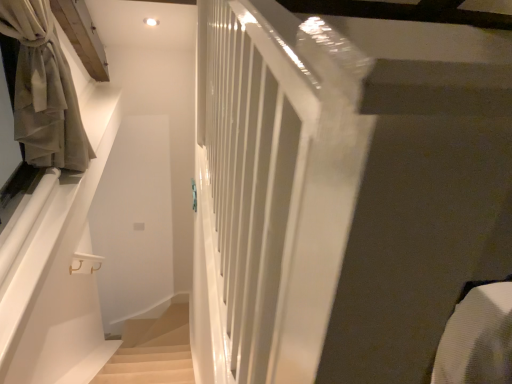
Question: Is beige fabric curtain at left in front of or behind beige carpeted stairs at lower left in the image?

Choices:
 (A) behind
 (B) front

Answer: (B)

Question: Considering the positions of point (42, 14) and point (110, 377), is point (42, 14) closer or farther from the camera than point (110, 377)?

Choices:
 (A) closer
 (B) farther

Answer: (A)

Question: Would you say beige fabric curtain at left is inside or outside beige carpeted stairs at lower left?

Choices:
 (A) inside
 (B) outside

Answer: (B)

Question: From the image's perspective, is beige carpeted stairs at lower left located above or below beige fabric curtain at left?

Choices:
 (A) below
 (B) above

Answer: (A)

Question: From a real-world perspective, relative to beige fabric curtain at left, is beige carpeted stairs at lower left vertically above or below?

Choices:
 (A) below
 (B) above

Answer: (A)

Question: Do you think beige carpeted stairs at lower left is within beige fabric curtain at left, or outside of it?

Choices:
 (A) inside
 (B) outside

Answer: (B)

Question: In terms of size, does beige carpeted stairs at lower left appear bigger or smaller than beige fabric curtain at left?

Choices:
 (A) small
 (B) big

Answer: (A)